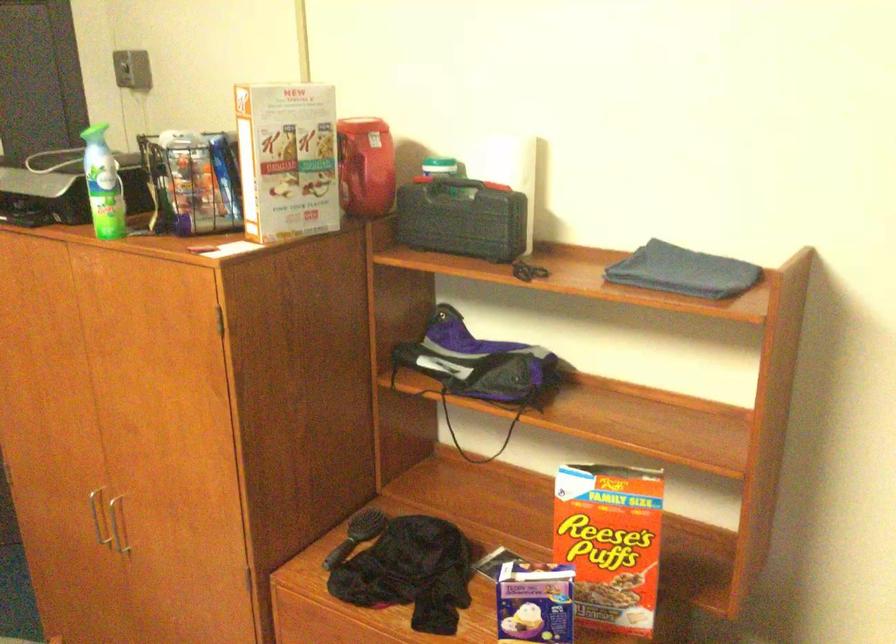
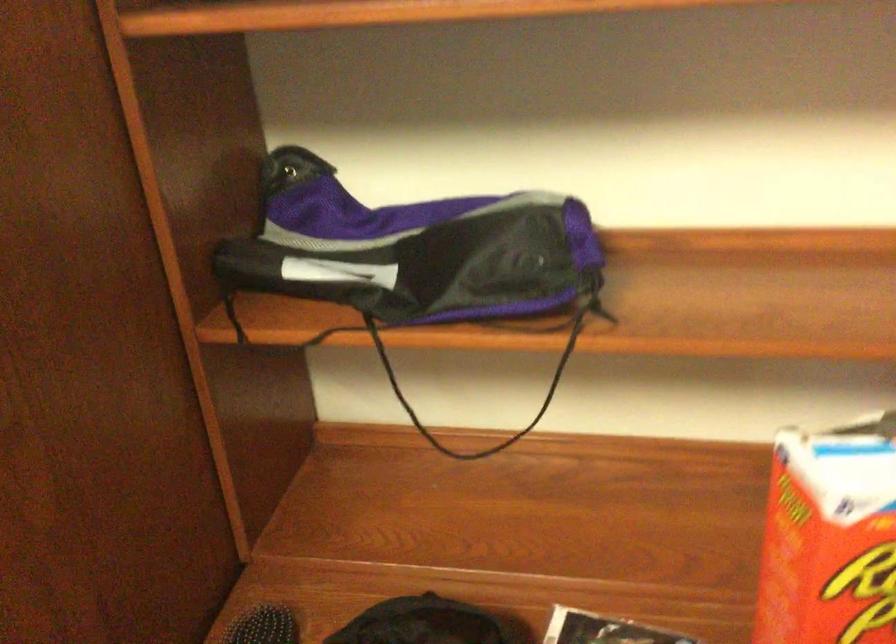
Question: In a continuous first-person perspective shot, in which direction is the camera moving?

Choices:
 (A) Left
 (B) Right
 (C) Forward
 (D) Backward

Answer: (C)